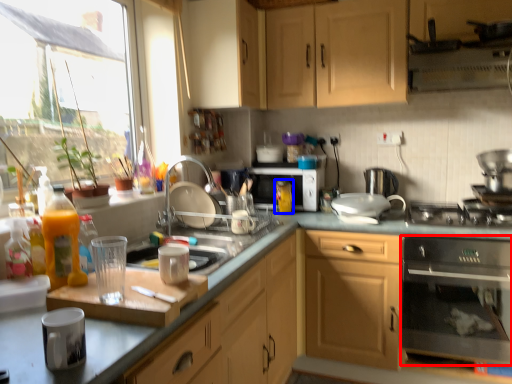
Question: Which object is closer to the camera taking this photo, kitchen appliance (highlighted by a red box) or bottle (highlighted by a blue box)?

Choices:
 (A) kitchen appliance
 (B) bottle

Answer: (A)